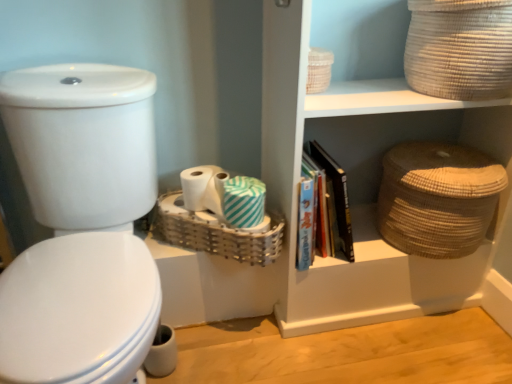
The image size is (512, 384). Find the location of `vacant space in front of white paper roll at center`. vacant space in front of white paper roll at center is located at coordinates (210, 213).